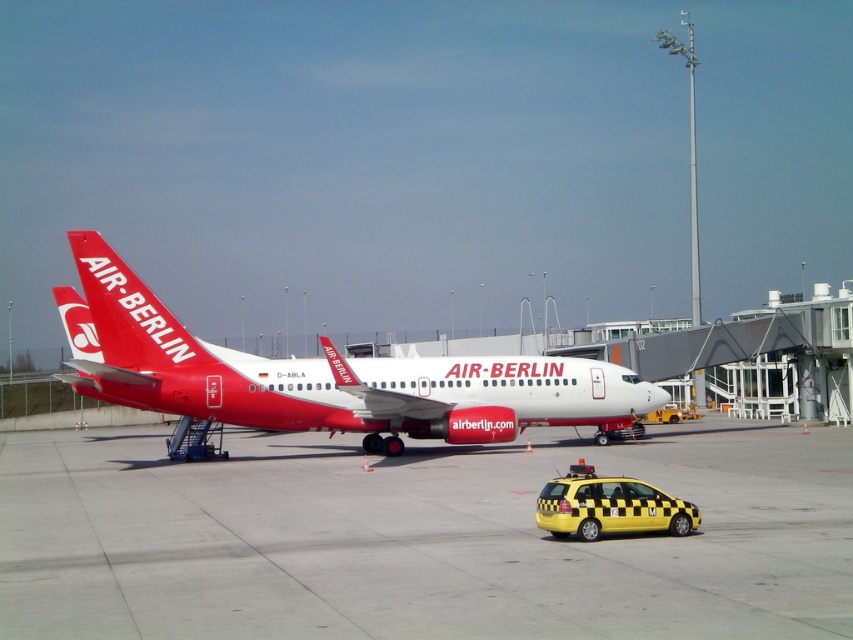
Question: Which point appears farthest from the camera in this image?

Choices:
 (A) (115, 481)
 (B) (294, 387)
 (C) (660, 515)

Answer: (B)

Question: Is matte white airplane at center bigger than yellow checkered taxi at lower right?

Choices:
 (A) yes
 (B) no

Answer: (A)

Question: Can you confirm if matte white airplane at center is thinner than yellow checkered taxi at lower right?

Choices:
 (A) no
 (B) yes

Answer: (A)

Question: Can you confirm if matte white airplane at center is positioned above yellow checkered taxi at lower right?

Choices:
 (A) yes
 (B) no

Answer: (A)

Question: Estimate the real-world distances between objects in this image. Which object is closer to the matte white airplane at center?

Choices:
 (A) yellow checkered taxi at lower right
 (B) smooth concrete tarmac at center

Answer: (B)

Question: Which point is farther from the camera taking this photo?

Choices:
 (A) (457, 392)
 (B) (671, 506)
 (C) (413, 634)

Answer: (A)